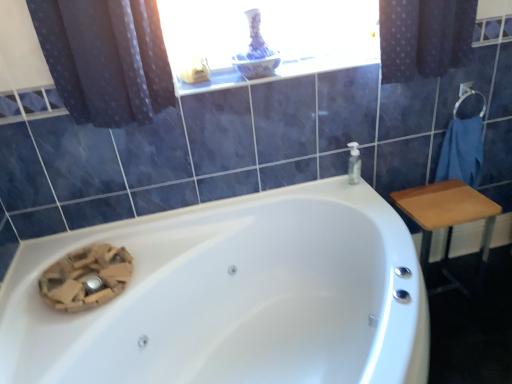
Where is `free spot above wooden table at right (from a real-world perspective)`? The image size is (512, 384). free spot above wooden table at right (from a real-world perspective) is located at coordinates (437, 203).